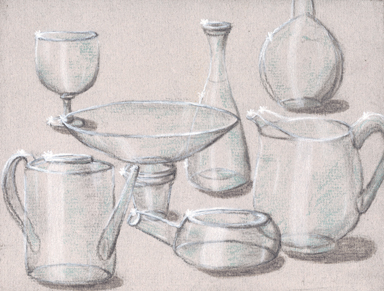
Image resolution: width=384 pixels, height=291 pixels. What are the coordinates of `art` in the screenshot? It's located at (212, 155).